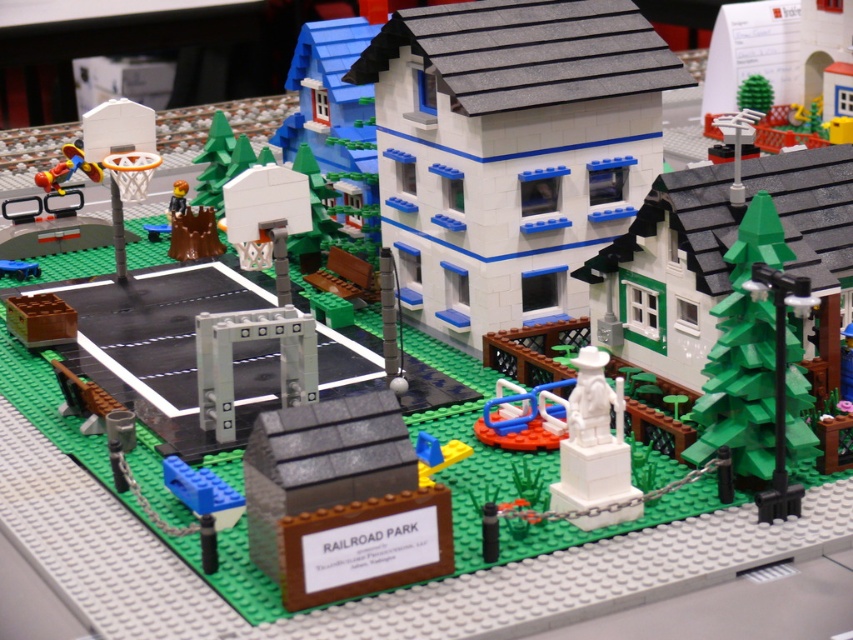
Question: Does white matte building at center have a larger size compared to white matte statue at center?

Choices:
 (A) no
 (B) yes

Answer: (B)

Question: Which of the following is the closest to the observer?

Choices:
 (A) (32, 269)
 (B) (622, 508)
 (C) (527, 268)
 (D) (51, 172)

Answer: (B)

Question: Estimate the real-world distances between objects in this image. Which object is closer to the shiny plastic toy at left?

Choices:
 (A) white matte statue at center
 (B) blue plastic toy at lower left
 (C) white matte building at center

Answer: (B)

Question: Is green matte tree at center-right wider than blue plastic toy at lower left?

Choices:
 (A) yes
 (B) no

Answer: (A)

Question: Is green matte tree at center-right to the left of white matte statue at center from the viewer's perspective?

Choices:
 (A) yes
 (B) no

Answer: (B)

Question: Which object is farther from the camera taking this photo?

Choices:
 (A) white matte statue at center
 (B) white matte building at center
 (C) blue plastic toy at lower left

Answer: (C)